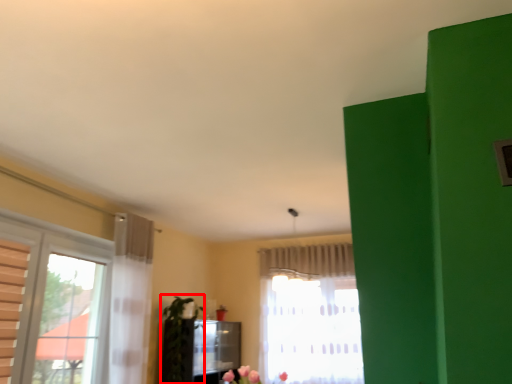
Question: From the image's perspective, considering the relative positions of plant (annotated by the red box) and curtain in the image provided, where is plant (annotated by the red box) located with respect to the staircase?

Choices:
 (A) below
 (B) above

Answer: (A)